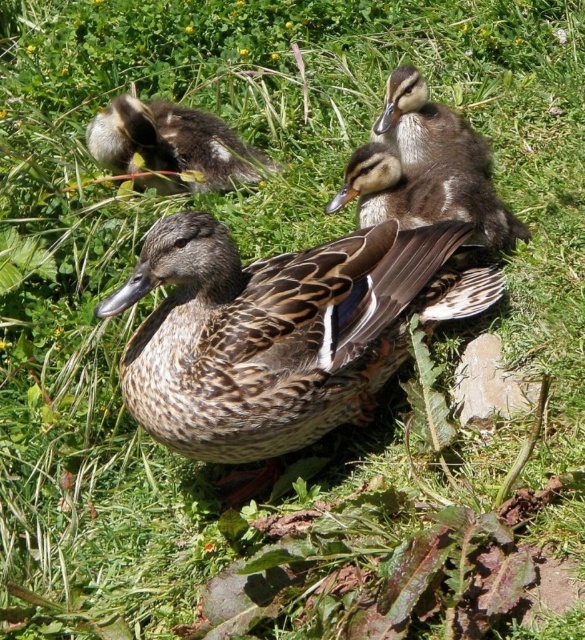
You are a birdwatcher observing the scene. You notice the brown speckled duck at center and the brown fuzzy duckling at upper left. Which one has a greater width?

The brown speckled duck at center might be wider than brown fuzzy duckling at upper left according to the description.

In the scene shown: You are a photographer trying to capture a closeup of the ducklings. You notice the brown speckled duckling at center and the brown speckled duckling at upper center. Which duckling is positioned closer to you?

The brown speckled duckling at center is closer to the viewer than the brown speckled duckling at upper center.

You are a photographer trying to capture a closeup of the brown fuzzy duckling at upper left. You are currently positioned at the point with coordinates point (173, 145). Is this the correct position to get a clear shot of the brown fuzzy duckling at upper left?

Yes, because point (173, 145) corresponds to the brown fuzzy duckling at upper left, so positioning yourself there would allow you to capture a clear closeup.